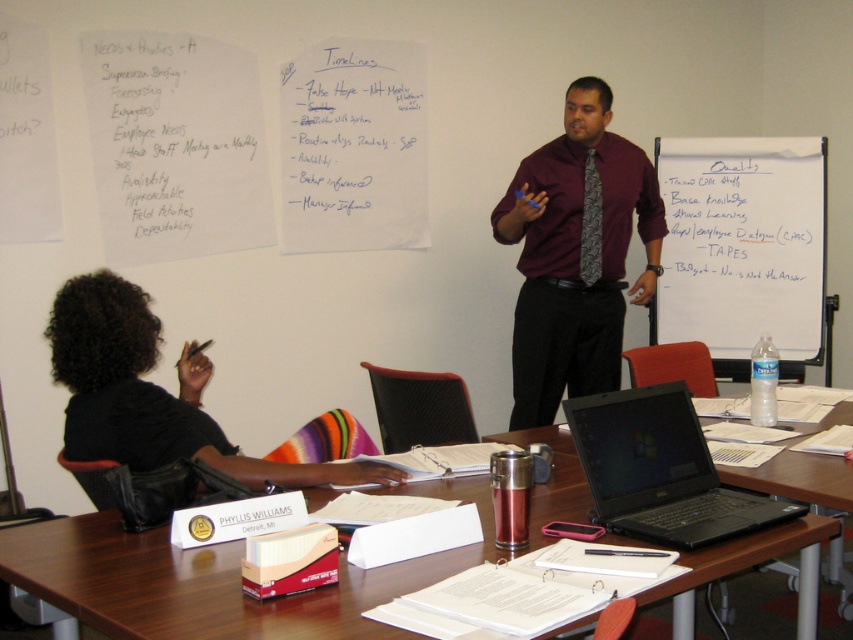
Question: Based on their relative distances, which object is nearer to the whiteboard at upper right?

Choices:
 (A) wooden table at center
 (B) dark gray textured tie at center
 (C) black matte laptop at center

Answer: (B)

Question: Which point appears farthest from the camera in this image?

Choices:
 (A) (775, 504)
 (B) (579, 147)

Answer: (B)

Question: Does wooden table at center appear on the right side of maroon shirt at center?

Choices:
 (A) no
 (B) yes

Answer: (A)

Question: Is wooden table at center further to the viewer compared to whiteboard at upper right?

Choices:
 (A) yes
 (B) no

Answer: (B)

Question: Which point appears farthest from the camera in this image?

Choices:
 (A) (119, 636)
 (B) (761, 499)
 (C) (579, 83)
 (D) (801, 182)

Answer: (D)

Question: Is whiteboard at upper right above dark gray textured tie at center?

Choices:
 (A) yes
 (B) no

Answer: (B)